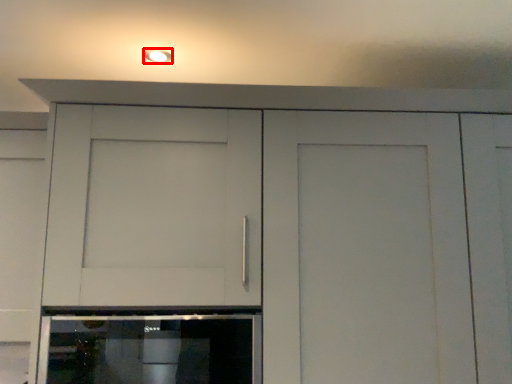
Question: From the image's perspective, considering the relative positions of lighting (annotated by the red box) and home appliance in the image provided, where is lighting (annotated by the red box) located with respect to the staircase?

Choices:
 (A) above
 (B) below

Answer: (A)